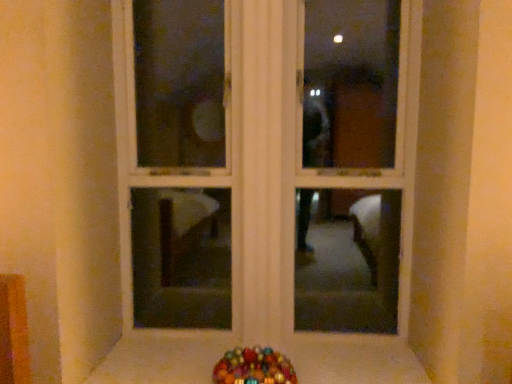
Question: Considering the relative positions of white wood window frame at center and glossy plastic candy at lower center in the image provided, is white wood window frame at center to the left of glossy plastic candy at lower center from the viewer's perspective?

Choices:
 (A) no
 (B) yes

Answer: (A)

Question: Is white wood window frame at center thinner than glossy plastic candy at lower center?

Choices:
 (A) no
 (B) yes

Answer: (B)

Question: Does white wood window frame at center turn towards glossy plastic candy at lower center?

Choices:
 (A) yes
 (B) no

Answer: (A)

Question: Is white wood window frame at center far away from glossy plastic candy at lower center?

Choices:
 (A) yes
 (B) no

Answer: (B)

Question: Is white wood window frame at center bigger than glossy plastic candy at lower center?

Choices:
 (A) no
 (B) yes

Answer: (B)

Question: Is white wood window frame at center oriented away from glossy plastic candy at lower center?

Choices:
 (A) no
 (B) yes

Answer: (A)

Question: Can you confirm if smooth white surface at lower center is bigger than white wood window frame at center?

Choices:
 (A) no
 (B) yes

Answer: (A)

Question: Is smooth white surface at lower center wider than white wood window frame at center?

Choices:
 (A) no
 (B) yes

Answer: (B)

Question: From a real-world perspective, is smooth white surface at lower center located higher than white wood window frame at center?

Choices:
 (A) yes
 (B) no

Answer: (B)

Question: From the image's perspective, would you say smooth white surface at lower center is shown under white wood window frame at center?

Choices:
 (A) yes
 (B) no

Answer: (A)

Question: Is smooth white surface at lower center taller than white wood window frame at center?

Choices:
 (A) no
 (B) yes

Answer: (A)

Question: Does smooth white surface at lower center have a smaller size compared to white wood window frame at center?

Choices:
 (A) no
 (B) yes

Answer: (B)

Question: Does white wood window frame at center lie behind smooth white surface at lower center?

Choices:
 (A) yes
 (B) no

Answer: (A)